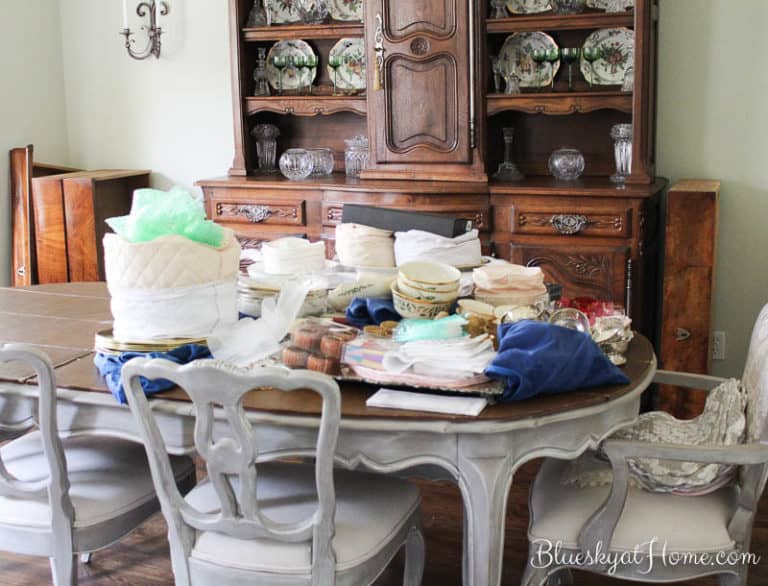
Image resolution: width=768 pixels, height=586 pixels. I want to click on tabletop, so click(x=61, y=305), click(x=550, y=405), click(x=280, y=396).